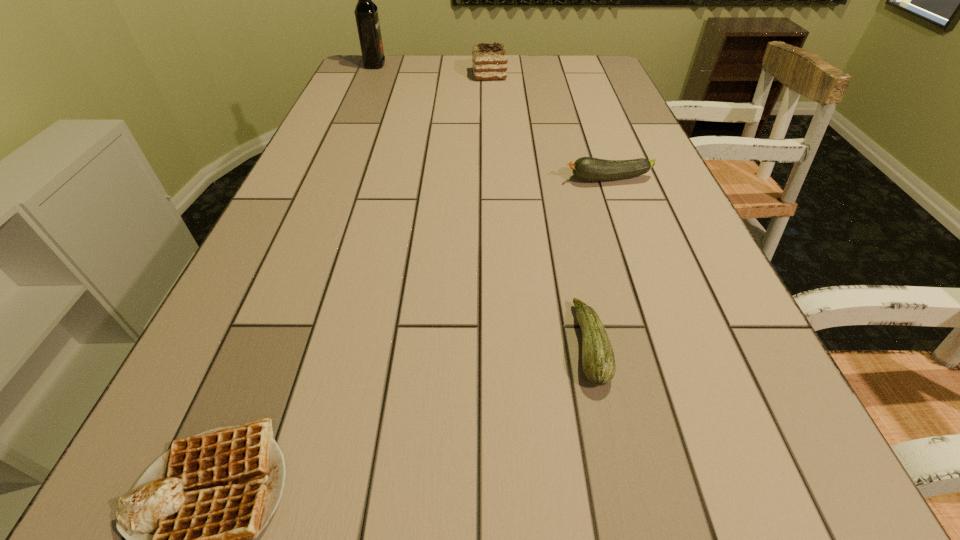
The image size is (960, 540). Identify the location of liquor. (366, 12).

Find the location of a particular element. This screenshot has width=960, height=540. the third object from right to left is located at coordinates (489, 61).

The height and width of the screenshot is (540, 960). Identify the location of the second tallest object. (489, 61).

The image size is (960, 540). I want to click on the third farthest object, so click(x=586, y=168).

Locate an element on the screen. the nearer zucchini is located at coordinates (598, 360).

Locate an element on the screen. The height and width of the screenshot is (540, 960). vacant position located on the front-facing side of the tallest object is located at coordinates (427, 65).

Where is `vacant space located 0.270m on the left of the chocolate cake`? This screenshot has height=540, width=960. vacant space located 0.270m on the left of the chocolate cake is located at coordinates (393, 75).

I want to click on free region located 0.320m at the blossom end of the third nearest object, so click(x=430, y=179).

Where is `vacant point located at the blossom end of the third nearest object`? The width and height of the screenshot is (960, 540). vacant point located at the blossom end of the third nearest object is located at coordinates (542, 179).

Identify the location of vacant space positioned 0.170m at the blossom end of the third nearest object. (492, 179).